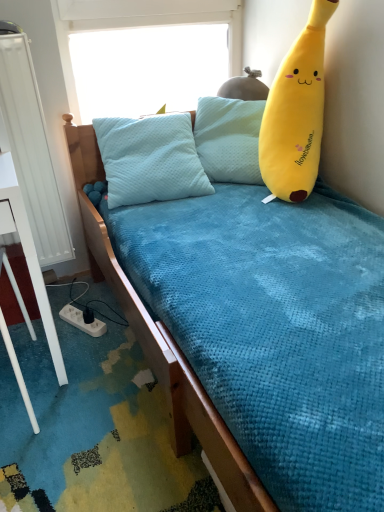
Question: Does transparent plastic window screen at upper center have a greater height compared to white plastic power outlet at lower left?

Choices:
 (A) yes
 (B) no

Answer: (A)

Question: From a real-world perspective, is transparent plastic window screen at upper center located beneath white plastic power outlet at lower left?

Choices:
 (A) no
 (B) yes

Answer: (A)

Question: Is transparent plastic window screen at upper center surrounding white plastic power outlet at lower left?

Choices:
 (A) yes
 (B) no

Answer: (B)

Question: Does transparent plastic window screen at upper center have a lesser height compared to white plastic power outlet at lower left?

Choices:
 (A) no
 (B) yes

Answer: (A)

Question: From the image's perspective, is transparent plastic window screen at upper center located above white plastic power outlet at lower left?

Choices:
 (A) no
 (B) yes

Answer: (B)

Question: Choose the correct answer: Is white plastic power outlet at lower left inside yellow plush toy at right or outside it?

Choices:
 (A) inside
 (B) outside

Answer: (B)

Question: In the image, is white plastic power outlet at lower left positioned in front of or behind yellow plush toy at right?

Choices:
 (A) front
 (B) behind

Answer: (B)

Question: Based on their positions, is white plastic power outlet at lower left located to the left or right of yellow plush toy at right?

Choices:
 (A) left
 (B) right

Answer: (A)

Question: Looking at the image, does white plastic power outlet at lower left seem bigger or smaller compared to yellow plush toy at right?

Choices:
 (A) small
 (B) big

Answer: (A)

Question: Looking at their shapes, would you say white metallic radiator at left is wider or thinner than yellow plush toy at right?

Choices:
 (A) thin
 (B) wide

Answer: (A)

Question: Which is correct: white metallic radiator at left is inside yellow plush toy at right, or outside of it?

Choices:
 (A) outside
 (B) inside

Answer: (A)

Question: Considering the relative positions of white metallic radiator at left and yellow plush toy at right in the image provided, is white metallic radiator at left to the left or to the right of yellow plush toy at right?

Choices:
 (A) left
 (B) right

Answer: (A)

Question: From their relative heights in the image, would you say white metallic radiator at left is taller or shorter than yellow plush toy at right?

Choices:
 (A) tall
 (B) short

Answer: (A)

Question: Is transparent plastic window screen at upper center spatially inside white metallic radiator at left, or outside of it?

Choices:
 (A) outside
 (B) inside

Answer: (A)

Question: Does point (81, 56) appear closer or farther from the camera than point (52, 247)?

Choices:
 (A) farther
 (B) closer

Answer: (B)